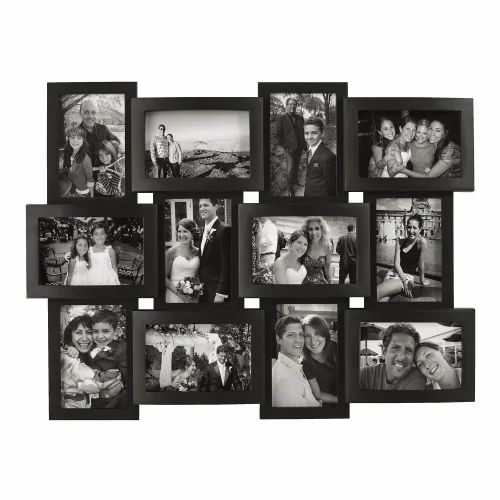
What are the coordinates of `top row of photos` in the screenshot? It's located at (113, 157), (187, 150), (280, 140), (370, 156).